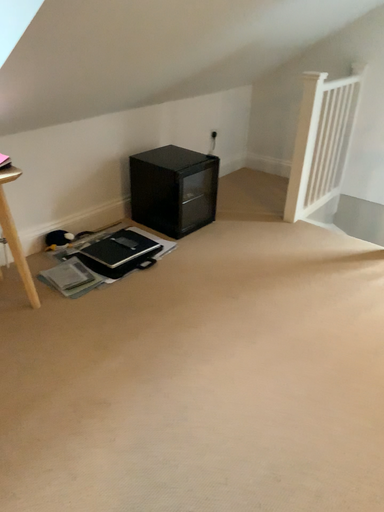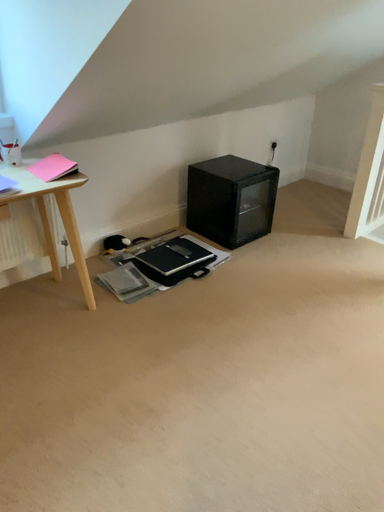
Question: How did the camera likely rotate when shooting the video?

Choices:
 (A) rotated left
 (B) rotated right

Answer: (A)